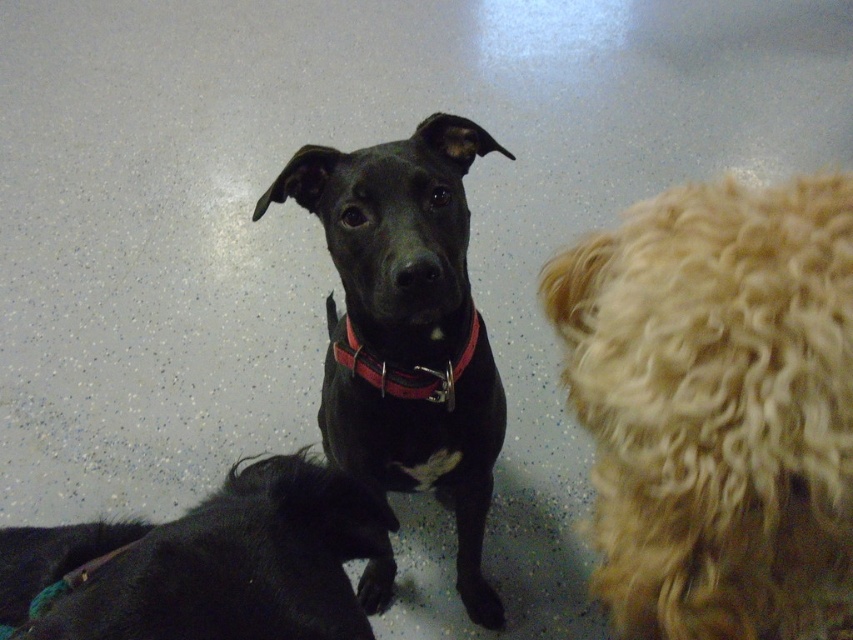
What is the color of the fur at the point with coordinates (717, 404)?

The point at coordinates (717, 404) corresponds to curly blonde fur at right.